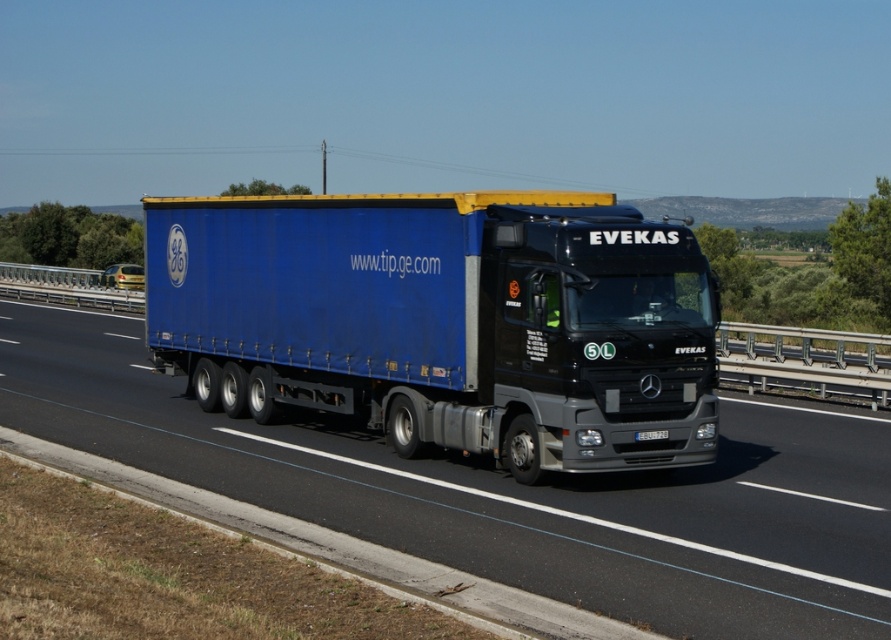
Who is higher up, blue matte trailer truck at center or blue fabric truck at center?

blue matte trailer truck at center is above.

Does blue matte trailer truck at center have a lesser height compared to blue fabric truck at center?

No, blue matte trailer truck at center is not shorter than blue fabric truck at center.

Is point (562, 296) behind point (454, 490)?

No, (562, 296) is closer to viewer.

Find the location of a particular element. The height and width of the screenshot is (640, 891). blue matte trailer truck at center is located at coordinates (446, 321).